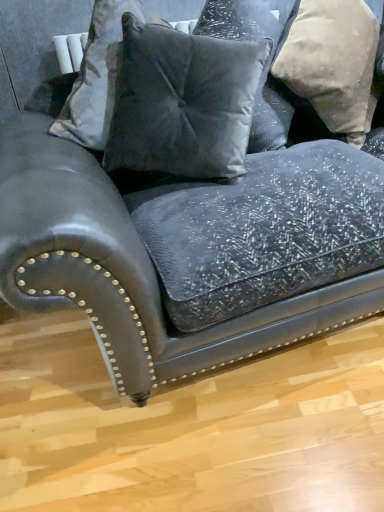
Question: Is velvet gray pillow at center, the first pillow positioned from the left, facing away from velvet gray pillow at upper center, which is the 2th pillow from right to left?

Choices:
 (A) no
 (B) yes

Answer: (B)

Question: From the image's perspective, does velvet gray pillow at center, the first pillow positioned from the left, appear higher than velvet gray pillow at upper center, placed as the second pillow when sorted from left to right?

Choices:
 (A) yes
 (B) no

Answer: (B)

Question: Does velvet gray pillow at center, which is counted as the 3th pillow, starting from the right, lie behind velvet gray pillow at upper center, which is the 2th pillow from right to left?

Choices:
 (A) yes
 (B) no

Answer: (B)

Question: Can you confirm if velvet gray pillow at center, the first pillow positioned from the left, is positioned to the right of velvet gray pillow at upper center, placed as the second pillow when sorted from left to right?

Choices:
 (A) no
 (B) yes

Answer: (A)

Question: From the image's perspective, is velvet gray pillow at center, which is counted as the 3th pillow, starting from the right, beneath velvet gray pillow at upper center, placed as the second pillow when sorted from left to right?

Choices:
 (A) no
 (B) yes

Answer: (B)

Question: Is velvet gray pillow at center, the first pillow positioned from the left, to the left of velvet gray pillow at upper center, placed as the second pillow when sorted from left to right, from the viewer's perspective?

Choices:
 (A) no
 (B) yes

Answer: (B)

Question: Is velvet gray pillow at upper center, which is the 2th pillow from right to left, at the right side of velvet gray pillow at center, which is counted as the 3th pillow, starting from the right?

Choices:
 (A) no
 (B) yes

Answer: (B)

Question: Can you confirm if velvet gray pillow at upper center, which is the 2th pillow from right to left, is shorter than velvet gray pillow at center, the first pillow positioned from the left?

Choices:
 (A) yes
 (B) no

Answer: (B)

Question: Is velvet gray pillow at upper center, placed as the second pillow when sorted from left to right, to the left of velvet gray pillow at center, which is counted as the 3th pillow, starting from the right, from the viewer's perspective?

Choices:
 (A) no
 (B) yes

Answer: (A)

Question: Is velvet gray pillow at upper center, placed as the second pillow when sorted from left to right, oriented away from velvet gray pillow at center, which is counted as the 3th pillow, starting from the right?

Choices:
 (A) yes
 (B) no

Answer: (B)

Question: Is velvet gray pillow at upper center, which is the 2th pillow from right to left, not near velvet gray pillow at center, the first pillow positioned from the left?

Choices:
 (A) no
 (B) yes

Answer: (A)

Question: From the image's perspective, is velvet gray pillow at upper center, which is the 2th pillow from right to left, under velvet gray pillow at center, the first pillow positioned from the left?

Choices:
 (A) no
 (B) yes

Answer: (A)

Question: Is beige textured pillow at upper right, the third pillow positioned from the left, taller than velvet gray pillow at upper center, which is the 2th pillow from right to left?

Choices:
 (A) yes
 (B) no

Answer: (A)